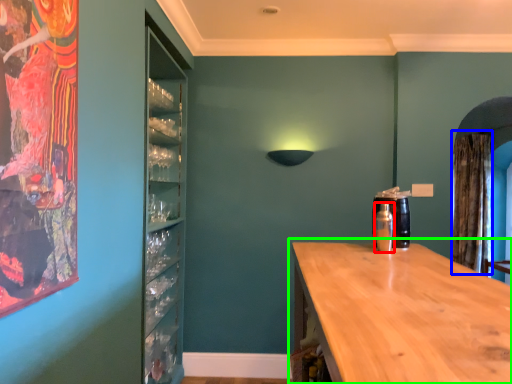
Question: Estimate the real-world distances between objects in this image. Which object is closer to bottle (highlighted by a red box), curtain (highlighted by a blue box) or countertop (highlighted by a green box)?

Choices:
 (A) curtain
 (B) countertop

Answer: (B)